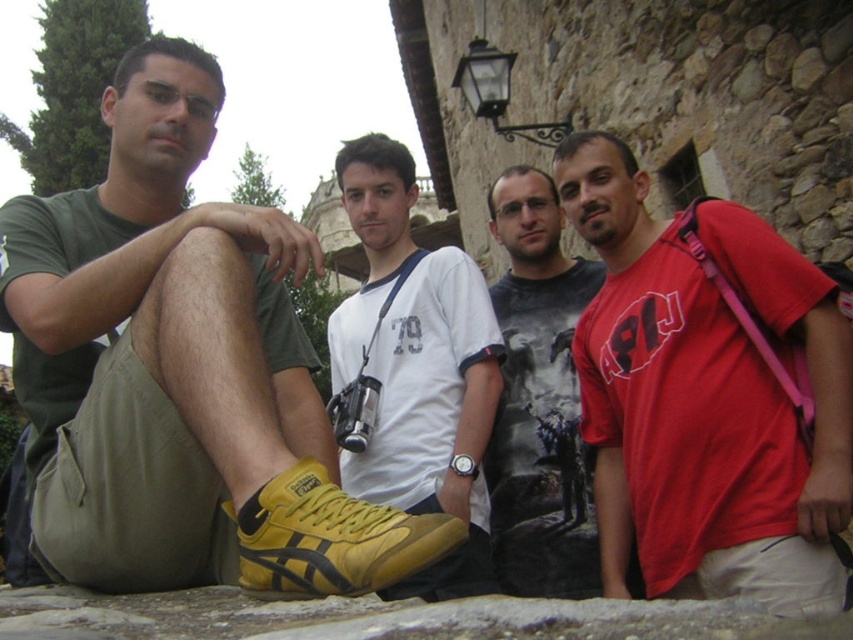
What do you see at coordinates (538, 396) in the screenshot?
I see `dark gray printed t-shirt at center` at bounding box center [538, 396].

Is point (570, 454) in front of point (260, 557)?

No.

Is point (587, 268) farther from camera compared to point (450, 541)?

Yes.

Identify the location of dark gray printed t-shirt at center. (538, 396).

Between yellow leather shoe at lower left and yellow suede sneaker at lower left, which one appears on the left side from the viewer's perspective?

yellow leather shoe at lower left is more to the left.

Who is positioned more to the right, yellow leather shoe at lower left or yellow suede sneaker at lower left?

Positioned to the right is yellow suede sneaker at lower left.

This screenshot has height=640, width=853. What are the coordinates of `yellow leather shoe at lower left` in the screenshot? It's located at (180, 372).

Between yellow leather shoe at center and yellow suede sneaker at lower left, which one appears on the left side from the viewer's perspective?

yellow suede sneaker at lower left is more to the left.

Is point (457, 577) more distant than point (361, 545)?

Yes.

Identify the location of yellow leather shoe at center. The image size is (853, 640). (416, 369).